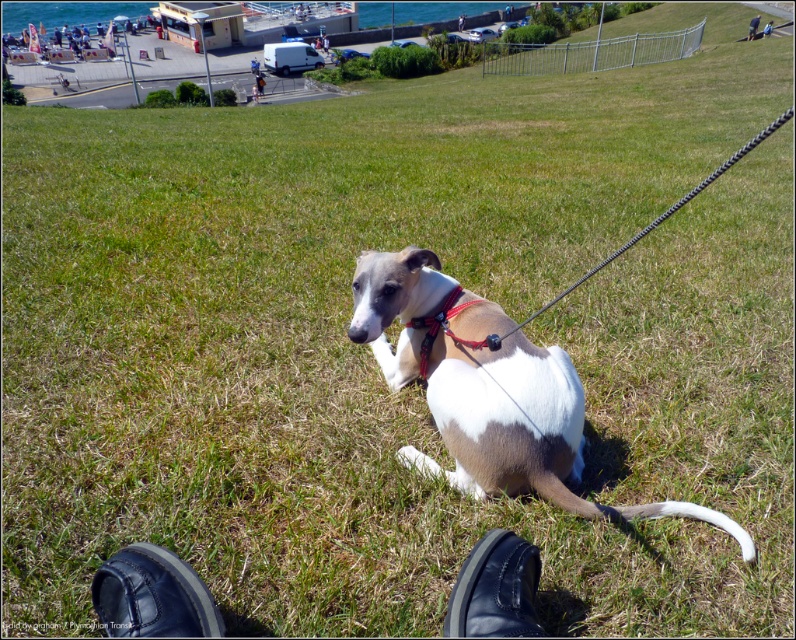
You are a photographer trying to capture the dog in the scene. You notice the brown and white fur at center and the red nylon collar at center. Which object should you focus on first if you want to highlight the dog from left to right?

The red nylon collar at center should be focused on first because the brown and white fur at center is positioned on its right side, meaning the collar comes first when moving from left to right.